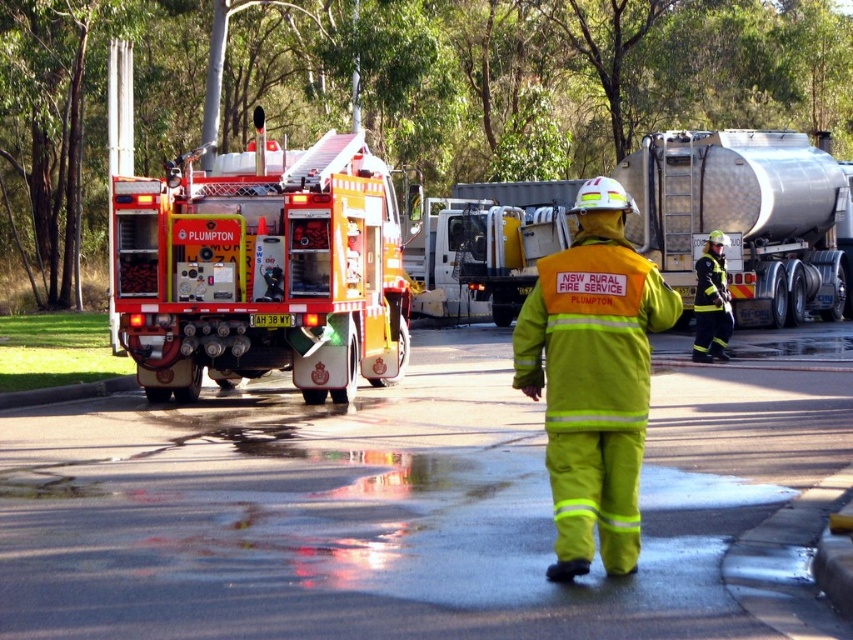
Question: Can you confirm if yellow reflective fire truck at center is wider than bright yellow reflective uniform at center?

Choices:
 (A) no
 (B) yes

Answer: (A)

Question: Is bright yellow reflective uniform at center to the left of polished silver trailer truck at upper right from the viewer's perspective?

Choices:
 (A) no
 (B) yes

Answer: (B)

Question: Considering the real-world distances, which object is farthest from the yellow reflective uniform at center?

Choices:
 (A) bright yellow reflective uniform at center
 (B) polished silver trailer truck at upper right
 (C) yellow reflective fire truck at center

Answer: (A)

Question: Among these objects, which one is farthest from the camera?

Choices:
 (A) bright yellow reflective uniform at center
 (B) polished silver trailer truck at upper right
 (C) yellow reflective uniform at center

Answer: (B)

Question: Is bright yellow reflective uniform at center thinner than yellow reflective uniform at center?

Choices:
 (A) no
 (B) yes

Answer: (A)

Question: Which of the following is the farthest from the observer?

Choices:
 (A) yellow reflective fire truck at center
 (B) polished silver trailer truck at upper right
 (C) yellow reflective uniform at center

Answer: (B)